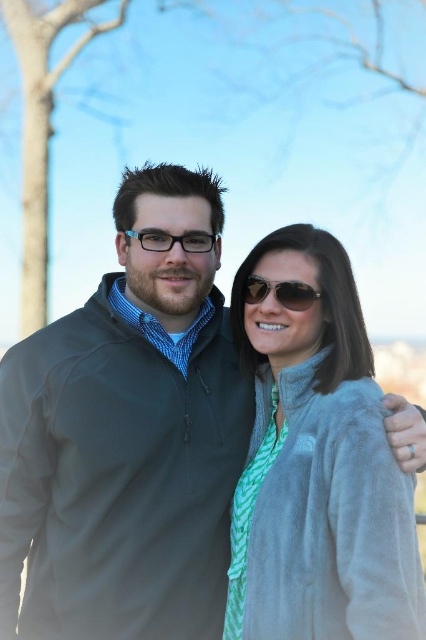
You are a photographer trying to capture a closeup shot of both the fuzzy gray jacket at center and the transparent plastic glasses at center. Your camera has a minimum focusing distance of 2 meters. Can you take the photo without moving either object?

The fuzzy gray jacket at center and transparent plastic glasses at center are 2.11 meters apart. Since the distance between them is greater than 2 meters, you can take the photo without moving either object as they are already spaced sufficiently apart.

You are a photographer trying to capture a closeup shot of the shiny black sunglasses at center and transparent plastic glasses at center. Which object should you focus on first if you want to ensure both are in focus without adjusting the camera settings?

You should focus on the transparent plastic glasses at center first because it is farther away from the viewer than the shiny black sunglasses at center. By focusing on the farther object, the near object will also be in focus due to the depth of field.